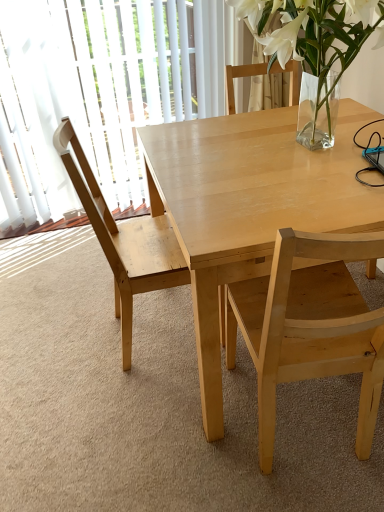
This screenshot has width=384, height=512. Identify the location of vacant region in front of light wood chair at left, which is the first chair from left to right. (137, 425).